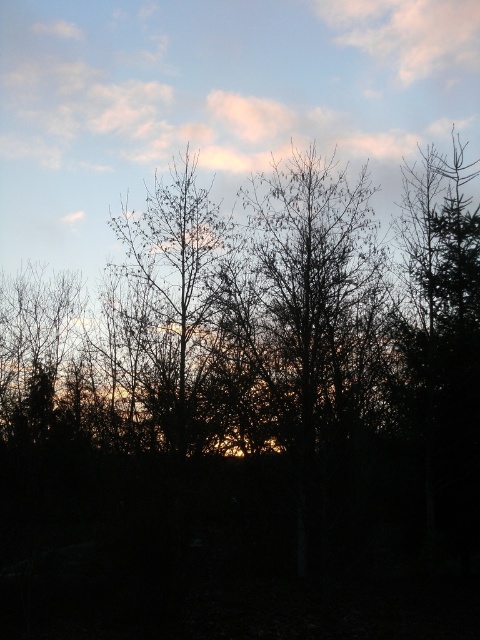
Question: Can you confirm if bare branches at center is positioned below pink cotton cloud at upper center?

Choices:
 (A) no
 (B) yes

Answer: (B)

Question: Among these objects, which one is farthest from the camera?

Choices:
 (A) pink cotton cloud at upper center
 (B) bare branches at center

Answer: (A)

Question: Which point is farther to the camera?

Choices:
 (A) pink cotton cloud at upper center
 (B) bare branches at center

Answer: (A)

Question: Does bare branches at center have a lesser width compared to pink cotton cloud at upper center?

Choices:
 (A) yes
 (B) no

Answer: (A)

Question: Does bare branches at center come in front of pink cotton cloud at upper center?

Choices:
 (A) no
 (B) yes

Answer: (B)